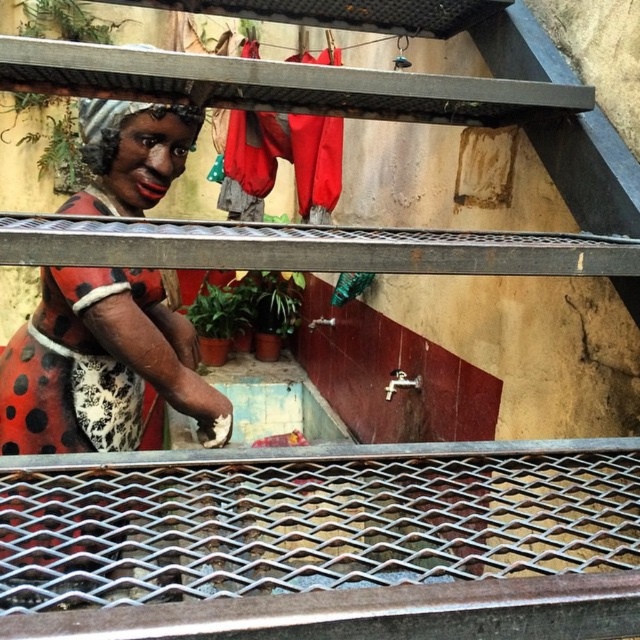
Question: Can you confirm if polka dot fabric at center is wider than metallic grid at center?

Choices:
 (A) no
 (B) yes

Answer: (A)

Question: Can you confirm if metallic grid at center is bigger than red fabric laundry at upper center?

Choices:
 (A) no
 (B) yes

Answer: (A)

Question: Which of the following is the closest to the observer?

Choices:
 (A) polka dot fabric at center
 (B) metallic grid at center
 (C) red fabric laundry at upper center

Answer: (A)

Question: Does metallic grid at center appear on the right side of red fabric laundry at upper center?

Choices:
 (A) yes
 (B) no

Answer: (A)

Question: Which of the following is the farthest from the observer?

Choices:
 (A) polka dot fabric at center
 (B) red fabric laundry at upper center
 (C) metallic grid at center

Answer: (B)

Question: Which object is positioned closest to the red fabric laundry at upper center?

Choices:
 (A) polka dot fabric at center
 (B) metallic grid at center

Answer: (A)